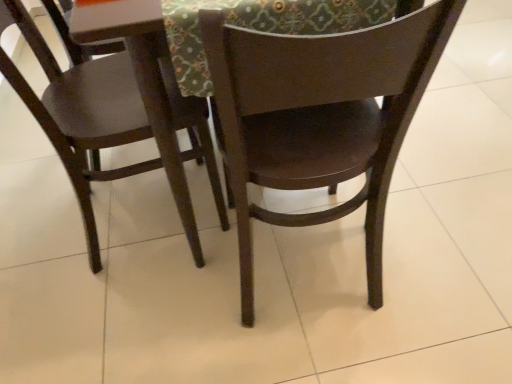
You are a GUI agent. You are given a task and a screenshot of the screen. Output one action in this format:
    pyautogui.click(x=<x>, y=<y>)
    Task: Click on the free space between matte brown table at center and dark wood chair at center, the first chair viewed from the right
    This screenshot has height=384, width=512.
    Given the screenshot: What is the action you would take?
    pyautogui.click(x=288, y=294)